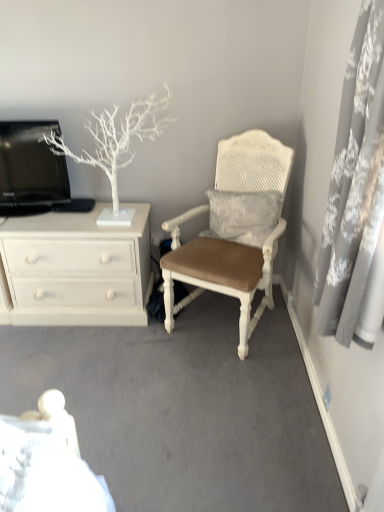
Question: Is white textured cushioned chair at center taller or shorter than white matte tree at upper left?

Choices:
 (A) short
 (B) tall

Answer: (B)

Question: Is white textured cushioned chair at center spatially inside white matte tree at upper left, or outside of it?

Choices:
 (A) inside
 (B) outside

Answer: (B)

Question: Which of these objects is positioned closest to the black glossy television at upper left?

Choices:
 (A) white textured cushioned chair at center
 (B) gray lace curtain at right
 (C) white matte tree at upper left
 (D) white painted wood chest of drawers at left

Answer: (C)

Question: Based on their relative distances, which object is nearer to the white textured cushioned chair at center?

Choices:
 (A) black glossy television at upper left
 (B) white matte tree at upper left
 (C) gray lace curtain at right
 (D) white painted wood chest of drawers at left

Answer: (D)